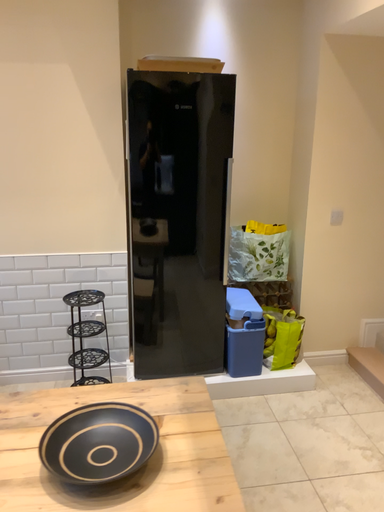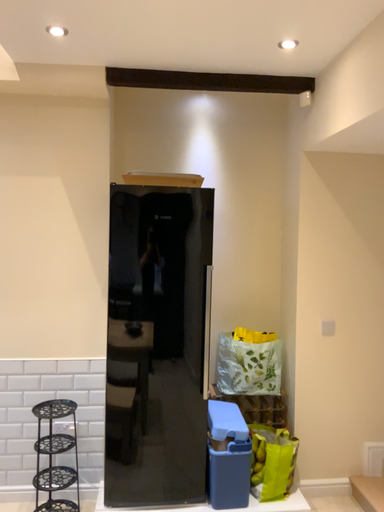
Question: Which way did the camera rotate in the video?

Choices:
 (A) rotated downward
 (B) rotated upward

Answer: (B)